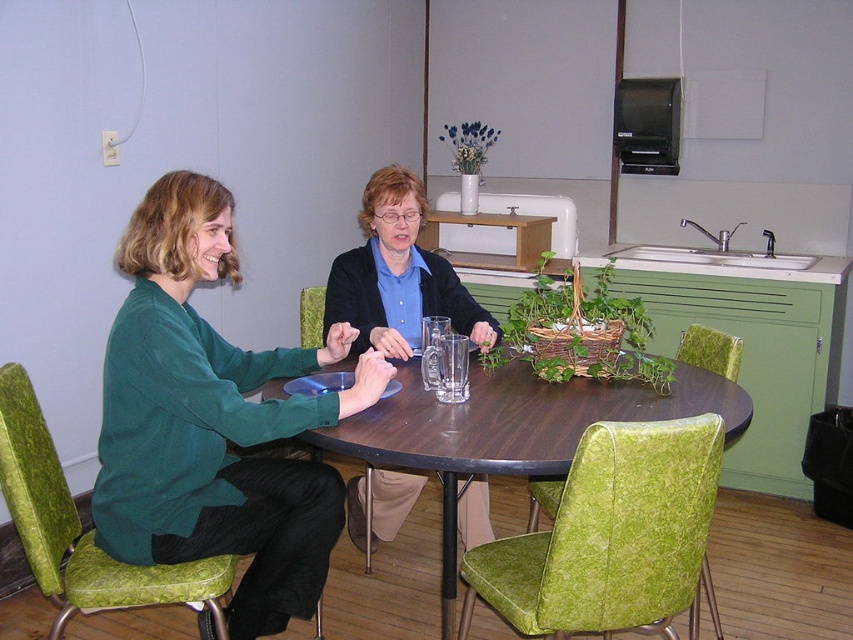
Question: Which object is closer to the camera taking this photo?

Choices:
 (A) wooden table at center
 (B) matte black sweater at center

Answer: (A)

Question: Which point is farther to the camera?

Choices:
 (A) (437, 413)
 (B) (347, 509)

Answer: (B)

Question: Can you confirm if wooden table at center is positioned to the right of matte black sweater at center?

Choices:
 (A) no
 (B) yes

Answer: (B)

Question: In this image, where is wooden table at center located relative to matte black sweater at center?

Choices:
 (A) below
 (B) above

Answer: (A)

Question: Which object is farther from the camera taking this photo?

Choices:
 (A) matte black sweater at center
 (B) wooden table at center

Answer: (A)

Question: Is wooden table at center below matte black sweater at center?

Choices:
 (A) no
 (B) yes

Answer: (B)